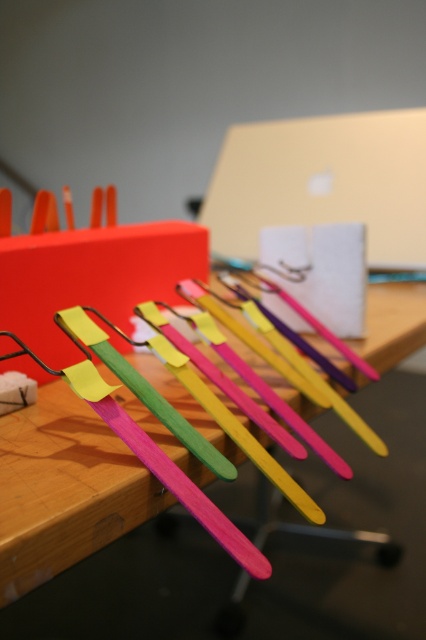
You are standing in front of the workspace shown in the image. Where is the wooden table at center located in terms of its 2D coordinates?

The wooden table at center is located at the 2D coordinates point (65, 488).

You need to place a rectangular box on the desk. Given the wooden table at center and the metallic gold laptop at center, which object should the box be placed on to ensure it fits properly?

The wooden table at center is larger in size than the metallic gold laptop at center, so the box should be placed on the wooden table at center to ensure it fits properly.

You are organizing your desk and want to place a new item between the wooden table at center and the metallic gold laptop at center. Is there enough space between them for a 10cm tall object?

The wooden table at center is below the metallic gold laptop at center, so there is vertical space between them. Since the object is 10cm tall, it can fit between them vertically.